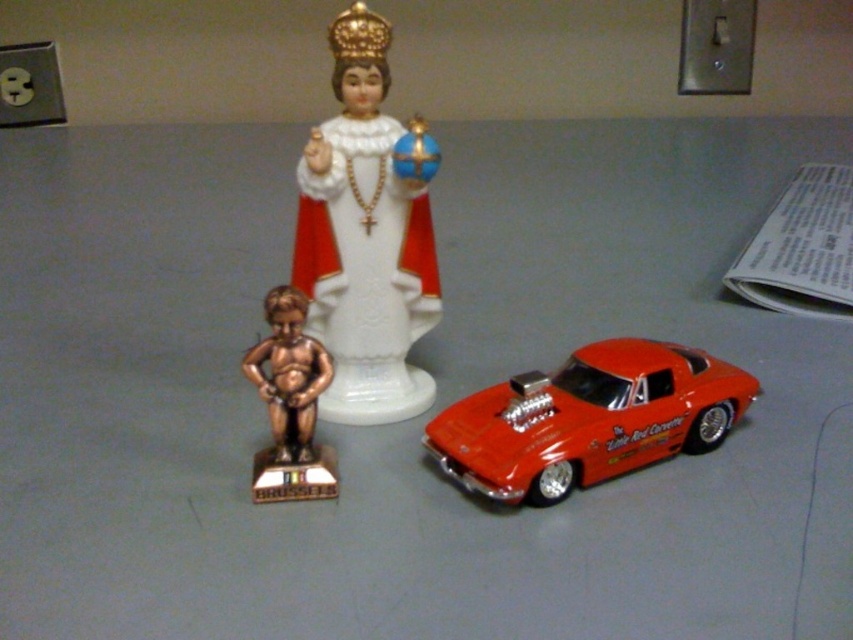
Question: Which object is farther from the camera taking this photo?

Choices:
 (A) white porcelain statue at center
 (B) gold-bronze statue at left
 (C) shiny red car at center

Answer: (A)

Question: Is the position of shiny red car at center less distant than that of gold-bronze statue at left?

Choices:
 (A) no
 (B) yes

Answer: (B)

Question: Can you confirm if shiny red car at center is smaller than gold-bronze statue at left?

Choices:
 (A) yes
 (B) no

Answer: (B)

Question: Which of the following is the closest to the observer?

Choices:
 (A) shiny red car at center
 (B) gold-bronze statue at left

Answer: (A)

Question: Which of these objects is positioned farthest from the gold-bronze statue at left?

Choices:
 (A) white porcelain statue at center
 (B) shiny red car at center

Answer: (B)

Question: In this image, where is white porcelain statue at center located relative to shiny red car at center?

Choices:
 (A) above
 (B) below

Answer: (A)